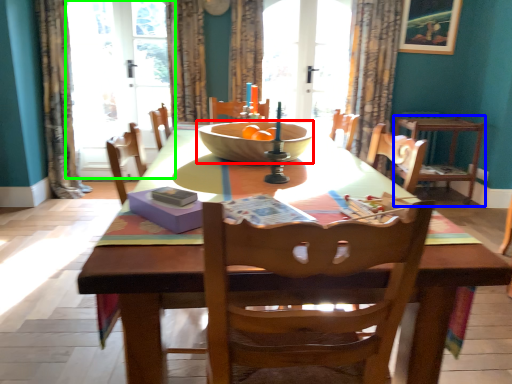
Question: Which object is the closest to the bowl (highlighted by a red box)? Choose among these: chair (highlighted by a blue box) or screen door (highlighted by a green box).

Choices:
 (A) chair
 (B) screen door

Answer: (A)